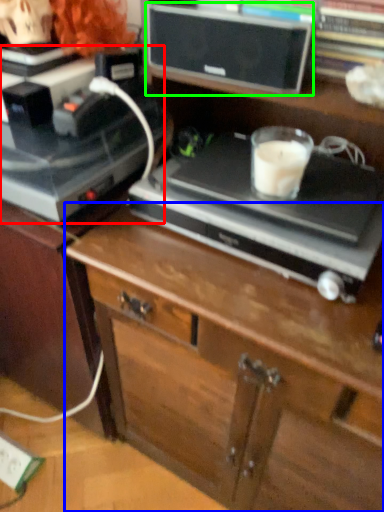
Question: Based on their relative distances, which object is farther from appliance (highlighted by a red box)? Choose from chest of drawers (highlighted by a blue box) and speaker (highlighted by a green box).

Choices:
 (A) chest of drawers
 (B) speaker

Answer: (A)